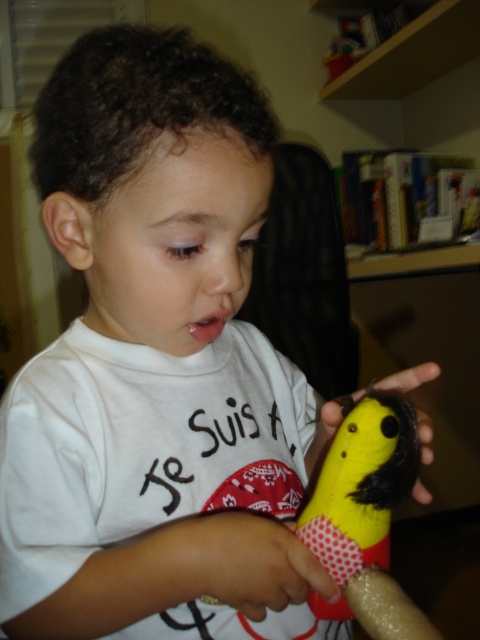
Question: Where is yellow fabric bird at center located in relation to soft yellow plush toy at center in the image?

Choices:
 (A) left
 (B) right

Answer: (B)

Question: Estimate the real-world distances between objects in this image. Which object is farther from the yellow fabric toy at center?

Choices:
 (A) soft yellow plush toy at center
 (B) yellow fabric bird at center

Answer: (A)

Question: From the image, what is the correct spatial relationship of yellow fabric bird at center in relation to soft yellow plush toy at center?

Choices:
 (A) right
 (B) left

Answer: (A)

Question: Which point is closer to the camera?

Choices:
 (A) soft yellow plush toy at center
 (B) yellow fabric toy at center

Answer: (A)

Question: Is yellow fabric bird at center bigger than yellow fabric toy at center?

Choices:
 (A) yes
 (B) no

Answer: (B)

Question: Among these objects, which one is nearest to the camera?

Choices:
 (A) yellow fabric bird at center
 (B) yellow fabric toy at center
 (C) soft yellow plush toy at center

Answer: (A)